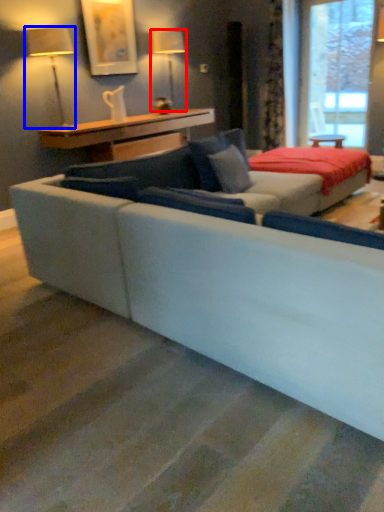
Question: Which of the following is the farthest to the observer, table lamp (highlighted by a red box) or table lamp (highlighted by a blue box)?

Choices:
 (A) table lamp
 (B) table lamp

Answer: (A)